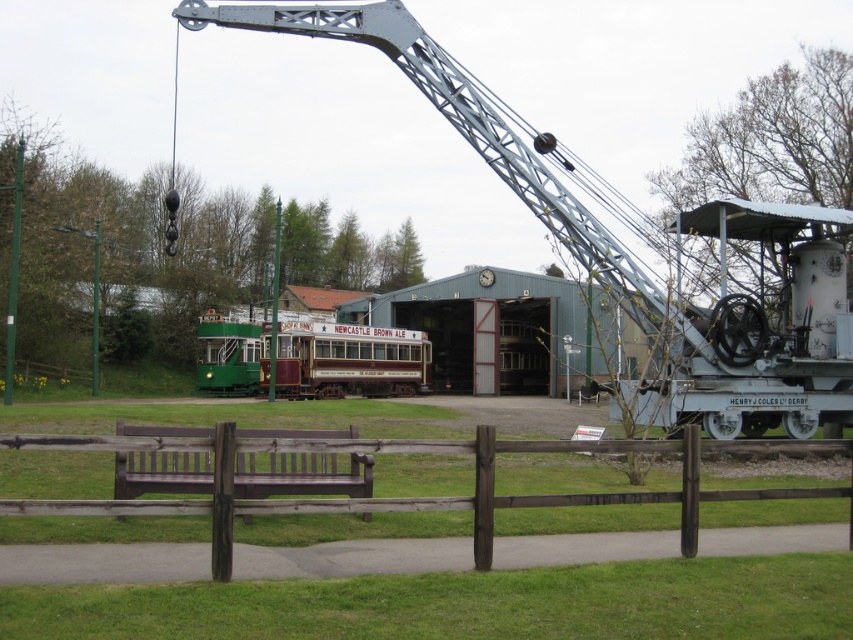
Can you confirm if metallic gray crane at center is wider than brown wooden bench at center?

Yes.

This screenshot has width=853, height=640. What are the coordinates of `metallic gray crane at center` in the screenshot? It's located at (498, 168).

Does green polished wood tram at center appear on the left side of brown wooden bench at center?

Indeed, green polished wood tram at center is positioned on the left side of brown wooden bench at center.

Is green polished wood tram at center thinner than brown wooden bench at center?

No.

What do you see at coordinates (311, 358) in the screenshot? I see `green polished wood tram at center` at bounding box center [311, 358].

Find the location of `green polished wood tram at center`. green polished wood tram at center is located at coordinates (311, 358).

Does metallic gray crane at center have a lesser width compared to brown wooden fence at lower center?

In fact, metallic gray crane at center might be wider than brown wooden fence at lower center.

Is metallic gray crane at center further to camera compared to brown wooden fence at lower center?

Yes, it is.

The width and height of the screenshot is (853, 640). What do you see at coordinates (498, 168) in the screenshot? I see `metallic gray crane at center` at bounding box center [498, 168].

Where is `metallic gray crane at center`? The width and height of the screenshot is (853, 640). metallic gray crane at center is located at coordinates (498, 168).